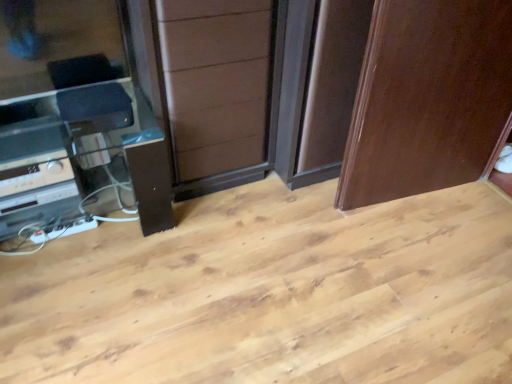
Where is `vacant space in front of satin black entertainment center at left`? The height and width of the screenshot is (384, 512). vacant space in front of satin black entertainment center at left is located at coordinates 93,320.